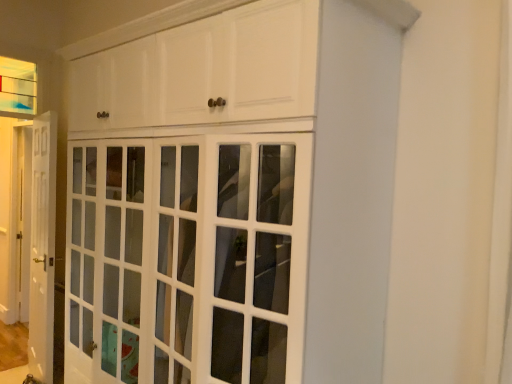
The image size is (512, 384). In order to click on white glossy door at left in this screenshot , I will do `click(42, 246)`.

What do you see at coordinates (234, 197) in the screenshot? I see `white glossy cabinet at center` at bounding box center [234, 197].

Find the location of a particular element. The height and width of the screenshot is (384, 512). clear glass window at upper left is located at coordinates (18, 86).

Based on the photo, are white glossy door at left and white glossy cabinet at center far apart?

That's right, there is a large distance between white glossy door at left and white glossy cabinet at center.

From the image's perspective, is white glossy door at left above or below white glossy cabinet at center?

white glossy door at left is below white glossy cabinet at center.

Looking at this image, how different are the orientations of white glossy door at left and white glossy cabinet at center in degrees?

They differ by 13.5 degrees in their facing directions.

Looking at this image, considering the sizes of objects white glossy door at left and white glossy cabinet at center in the image provided, who is taller, white glossy door at left or white glossy cabinet at center?

With more height is white glossy door at left.

From a real-world perspective, is white glossy cabinet at center physically above white glossy door at left?

Yes, from a real-world perspective, white glossy cabinet at center is above white glossy door at left.

From the picture: Is white glossy cabinet at center turned away from white glossy door at left?

No, white glossy cabinet at center is not facing the opposite direction of white glossy door at left.

Is white glossy cabinet at center behind white glossy door at left?

No, white glossy cabinet at center is closer to the camera.

From their relative heights in the image, would you say white glossy door at left is taller or shorter than clear glass window at upper left?

Considering their sizes, white glossy door at left has more height than clear glass window at upper left.

Could you tell me if white glossy door at left is facing clear glass window at upper left?

No, white glossy door at left is not oriented towards clear glass window at upper left.

Between white glossy door at left and clear glass window at upper left, which one appears on the right side from the viewer's perspective?

white glossy door at left is more to the right.

At what (x,y) coordinates should I click in order to perform the action: click on window behind the white glossy door at left. Please return your answer as a coordinate pair (x, y). Image resolution: width=512 pixels, height=384 pixels. Looking at the image, I should click on (18, 86).

Which is behind, white glossy cabinet at center or clear glass window at upper left?

clear glass window at upper left is further from the camera.

Is white glossy cabinet at center aimed at clear glass window at upper left?

No, white glossy cabinet at center does not turn towards clear glass window at upper left.

Does point (378, 301) come in front of point (15, 98)?

Yes, it is.

Considering the sizes of objects white glossy cabinet at center and clear glass window at upper left in the image provided, who is taller, white glossy cabinet at center or clear glass window at upper left?

Standing taller between the two is white glossy cabinet at center.

Image resolution: width=512 pixels, height=384 pixels. I want to click on cupboard lying in front of the clear glass window at upper left, so click(234, 197).

Measure the distance from clear glass window at upper left to white glossy cabinet at center.

7.78 feet.

How different are the orientations of clear glass window at upper left and white glossy cabinet at center in degrees?

clear glass window at upper left and white glossy cabinet at center are facing 89.1 degrees away from each other.

Can you confirm if clear glass window at upper left is thinner than white glossy cabinet at center?

Correct, the width of clear glass window at upper left is less than that of white glossy cabinet at center.

Does clear glass window at upper left contain white glossy door at left?

No, white glossy door at left is located outside of clear glass window at upper left.

From a real-world perspective, is clear glass window at upper left beneath white glossy door at left?

Actually, clear glass window at upper left is physically above white glossy door at left in the real world.

How different are the orientations of clear glass window at upper left and white glossy door at left in degrees?

The angle between the facing direction of clear glass window at upper left and the facing direction of white glossy door at left is 103 degrees.

Does clear glass window at upper left turn towards white glossy door at left?

No, clear glass window at upper left is not facing towards white glossy door at left.

The image size is (512, 384). I want to click on door that appears below the white glossy cabinet at center (from a real-world perspective), so (x=42, y=246).

You are a GUI agent. You are given a task and a screenshot of the screen. Output one action in this format:
    pyautogui.click(x=<x>, y=<y>)
    Task: Click on the door behind the white glossy cabinet at center
    The height and width of the screenshot is (384, 512).
    Given the screenshot: What is the action you would take?
    pyautogui.click(x=42, y=246)

Considering their positions, is white glossy door at left positioned closer to clear glass window at upper left than white glossy cabinet at center?

white glossy door at left lies closer to clear glass window at upper left than the other object.

Estimate the real-world distances between objects in this image. Which object is closer to white glossy cabinet at center, clear glass window at upper left or white glossy door at left?

The object closer to white glossy cabinet at center is white glossy door at left.

Which object lies further to the anchor point white glossy cabinet at center, white glossy door at left or clear glass window at upper left?

clear glass window at upper left is positioned further to the anchor white glossy cabinet at center.

Estimate the real-world distances between objects in this image. Which object is further from white glossy door at left, clear glass window at upper left or white glossy cabinet at center?

The object further to white glossy door at left is white glossy cabinet at center.

Based on their spatial positions, is white glossy cabinet at center or white glossy door at left closer to clear glass window at upper left?

Based on the image, white glossy door at left appears to be nearer to clear glass window at upper left.

Which object lies further to the anchor point white glossy door at left, white glossy cabinet at center or clear glass window at upper left?

The object further to white glossy door at left is white glossy cabinet at center.

Image resolution: width=512 pixels, height=384 pixels. What are the coordinates of `door between white glossy cabinet at center and clear glass window at upper left from front to back` in the screenshot? It's located at (42, 246).